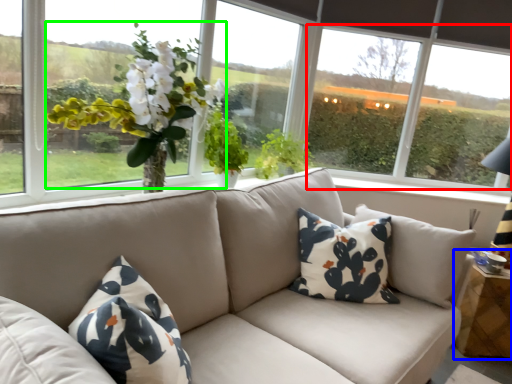
Question: Which object is positioned closest to window screen (highlighted by a red box)? Select from table (highlighted by a blue box) and floral arrangement (highlighted by a green box).

Choices:
 (A) table
 (B) floral arrangement

Answer: (A)